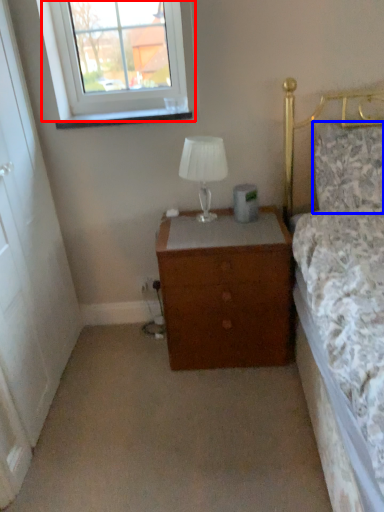
Question: Which of the following is the closest to the observer, window (highlighted by a red box) or pillow (highlighted by a blue box)?

Choices:
 (A) window
 (B) pillow

Answer: (B)